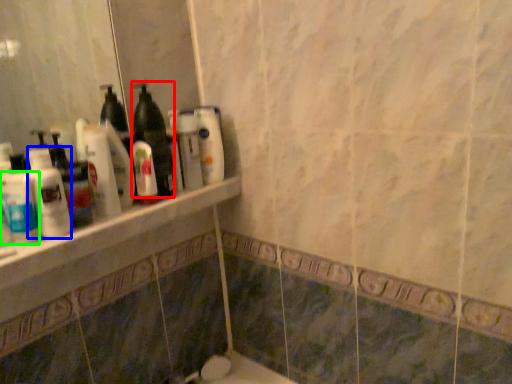
Question: Considering the real-world distances, which object is closest to bottle (highlighted by a red box)? cleaning product (highlighted by a blue box) or mouthwash (highlighted by a green box).

Choices:
 (A) cleaning product
 (B) mouthwash

Answer: (A)